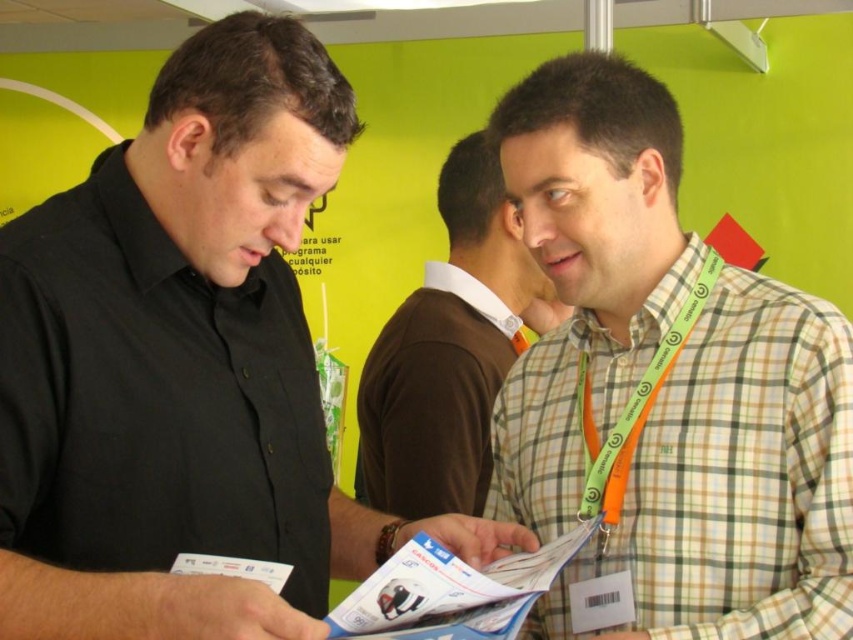
Between black shirt at left and orange fabric lanyard at right, which one appears on the left side from the viewer's perspective?

Positioned to the left is black shirt at left.

Is point (68, 376) positioned in front of point (625, 429)?

That is True.

Identify the location of black shirt at left. This screenshot has width=853, height=640. (184, 365).

Who is more distant from viewer, (549, 257) or (589, 381)?

The point (589, 381) is more distant.

From the picture: Is green plaid shirt at center shorter than orange fabric lanyard at right?

No, green plaid shirt at center is not shorter than orange fabric lanyard at right.

The width and height of the screenshot is (853, 640). What do you see at coordinates (664, 388) in the screenshot? I see `green plaid shirt at center` at bounding box center [664, 388].

At what (x,y) coordinates should I click in order to perform the action: click on green plaid shirt at center. Please return your answer as a coordinate pair (x, y). This screenshot has height=640, width=853. Looking at the image, I should click on (664, 388).

Is green plaid shirt at center bigger than plaid fabric shirt at center?

Actually, green plaid shirt at center might be smaller than plaid fabric shirt at center.

Does green plaid shirt at center have a greater width compared to plaid fabric shirt at center?

No, green plaid shirt at center is not wider than plaid fabric shirt at center.

Is point (509, 429) positioned in front of point (440, 413)?

Yes, point (509, 429) is in front of point (440, 413).

Find the location of a particular element. Image resolution: width=853 pixels, height=640 pixels. green plaid shirt at center is located at coordinates (664, 388).